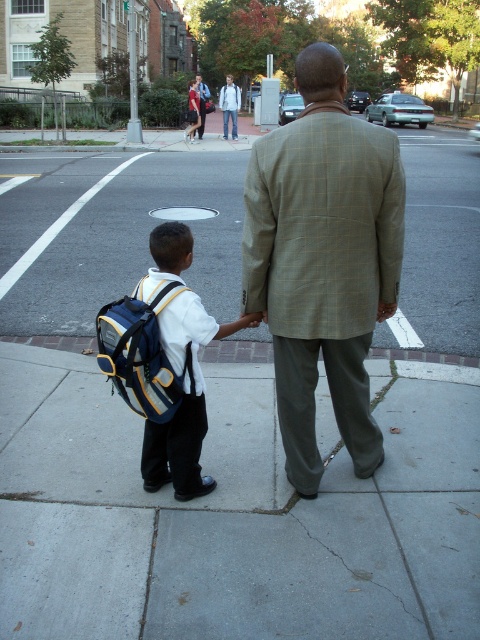
Which is above, plaid wool blazer at center or blue/yellow fabric backpack at lower left?

plaid wool blazer at center is higher up.

Who is lower down, plaid wool blazer at center or blue/yellow fabric backpack at lower left?

blue/yellow fabric backpack at lower left

Is point (299, 208) positioned in front of point (154, 355)?

That is True.

Find the location of a particular element. plaid wool blazer at center is located at coordinates click(323, 260).

Can you confirm if gray concrete sidewalk at center is shorter than blue/yellow fabric backpack at lower left?

Incorrect, gray concrete sidewalk at center's height does not fall short of blue/yellow fabric backpack at lower left's.

Does gray concrete sidewalk at center appear on the left side of blue/yellow fabric backpack at lower left?

Incorrect, gray concrete sidewalk at center is not on the left side of blue/yellow fabric backpack at lower left.

Which is in front, point (466, 616) or point (132, 336)?

Positioned in front is point (466, 616).

In order to click on gray concrete sidewalk at center in this screenshot , I will do `click(233, 515)`.

Between point (355, 234) and point (223, 326), which one is positioned behind?

The point (223, 326) is more distant.

Is point (342, 152) behind point (192, 340)?

No.

Identify the location of plaid wool blazer at center. This screenshot has height=640, width=480. (323, 260).